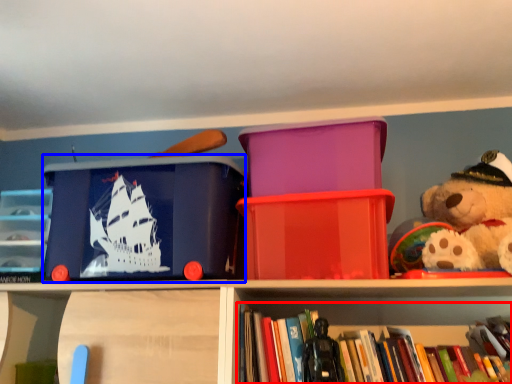
Question: Which object is closer to the camera taking this photo, book (highlighted by a red box) or storage box (highlighted by a blue box)?

Choices:
 (A) book
 (B) storage box

Answer: (A)